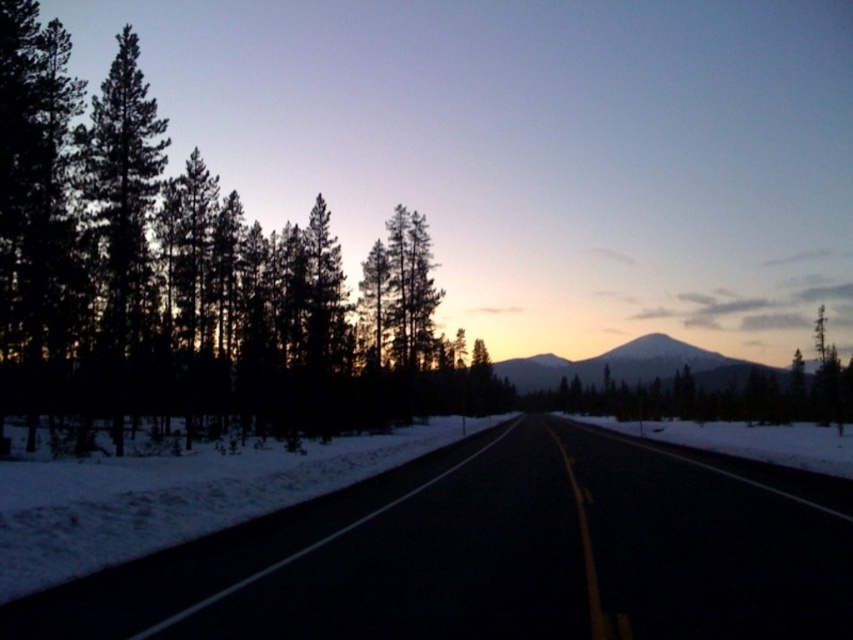
Question: Is silky dark green trees at left thinner than smooth snow-covered mountain at center?

Choices:
 (A) no
 (B) yes

Answer: (A)

Question: Is silky dark green trees at left above smooth snow-covered mountain at center?

Choices:
 (A) no
 (B) yes

Answer: (B)

Question: Which of the following is the closest to the observer?

Choices:
 (A) (51, 611)
 (B) (103, 156)

Answer: (A)

Question: Which is farther from the smooth snow-covered mountain at center?

Choices:
 (A) silky dark green trees at left
 (B) black asphalt road at center

Answer: (B)

Question: From the image, what is the correct spatial relationship of silky dark green trees at left in relation to smooth snow-covered mountain at center?

Choices:
 (A) above
 (B) below

Answer: (A)

Question: Which point is farther to the camera?

Choices:
 (A) black asphalt road at center
 (B) silky dark green trees at left

Answer: (B)